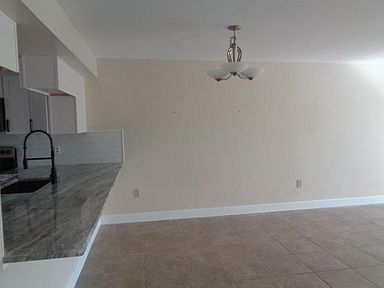
This screenshot has width=384, height=288. I want to click on faucet, so click(49, 160).